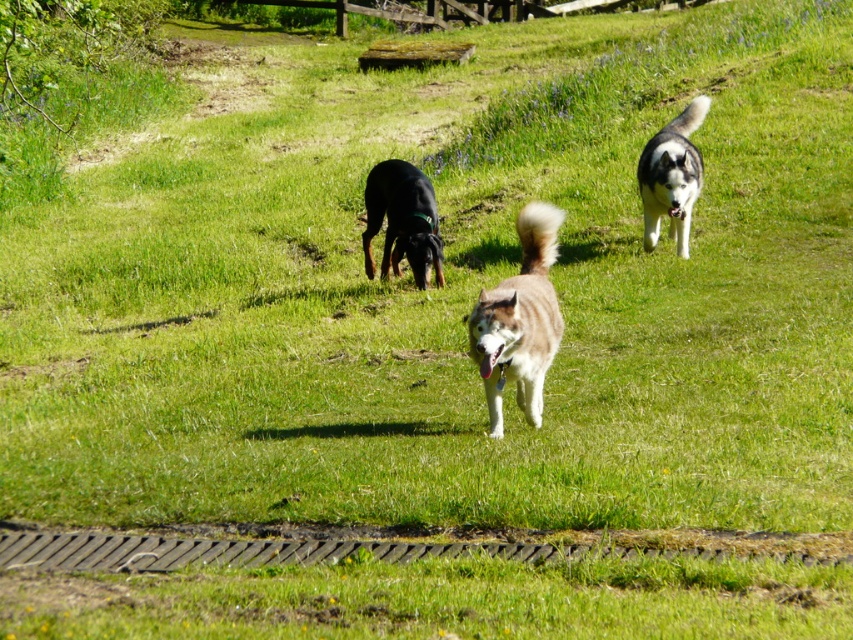
Question: Does black smooth dog at center appear on the right side of gray-white fur husky at upper right?

Choices:
 (A) no
 (B) yes

Answer: (A)

Question: Among these objects, which one is farthest from the camera?

Choices:
 (A) brown fur dog at center
 (B) gray-white fur husky at upper right
 (C) black smooth dog at center

Answer: (C)

Question: Does brown fur dog at center come behind gray-white fur husky at upper right?

Choices:
 (A) yes
 (B) no

Answer: (B)

Question: Which of the following is the closest to the observer?

Choices:
 (A) black smooth dog at center
 (B) brown fur dog at center
 (C) gray-white fur husky at upper right

Answer: (B)

Question: Can you confirm if brown fur dog at center is smaller than black smooth dog at center?

Choices:
 (A) no
 (B) yes

Answer: (A)

Question: Which point appears closest to the camera in this image?

Choices:
 (A) (647, 186)
 (B) (396, 204)

Answer: (B)